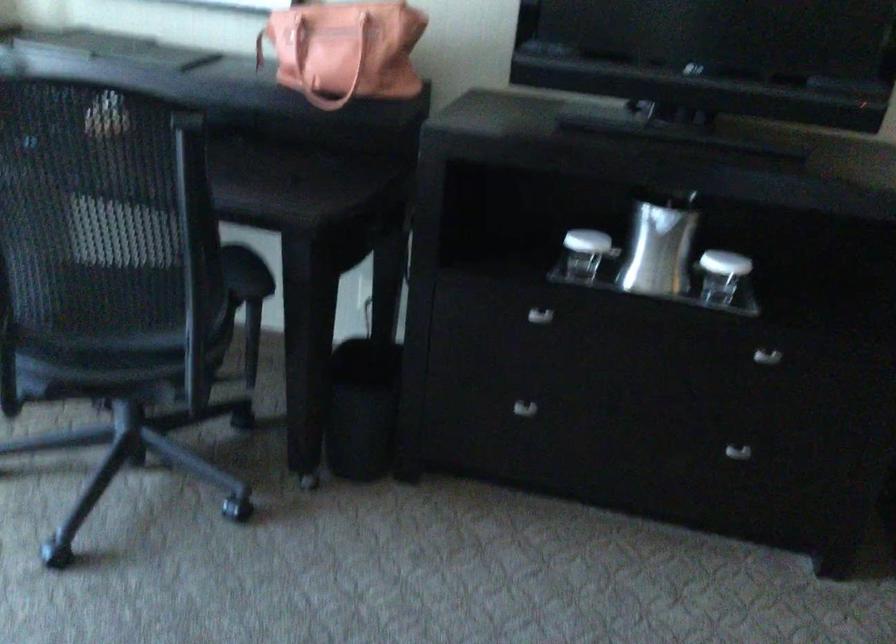
The location [362,408] corresponds to which object?

It corresponds to the black trash can in the image.